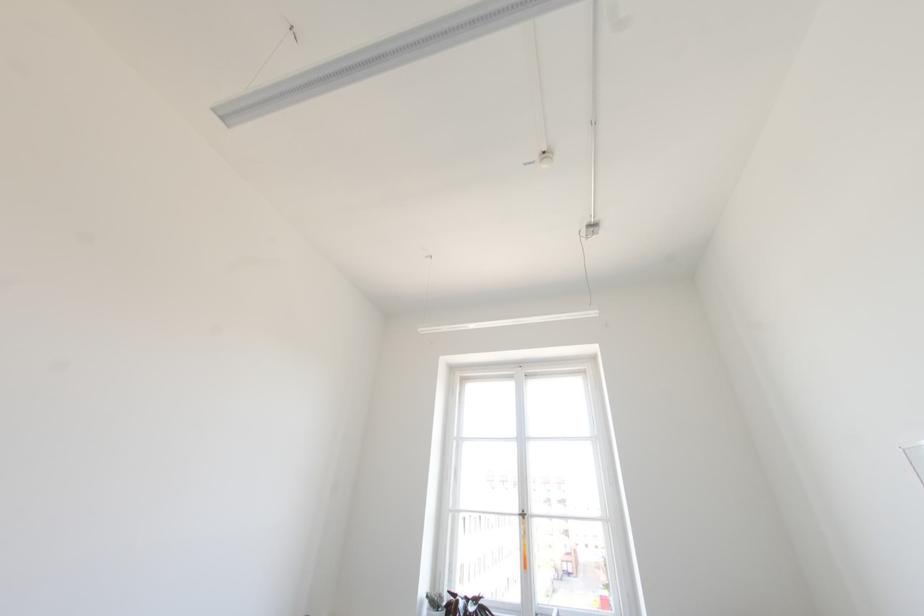
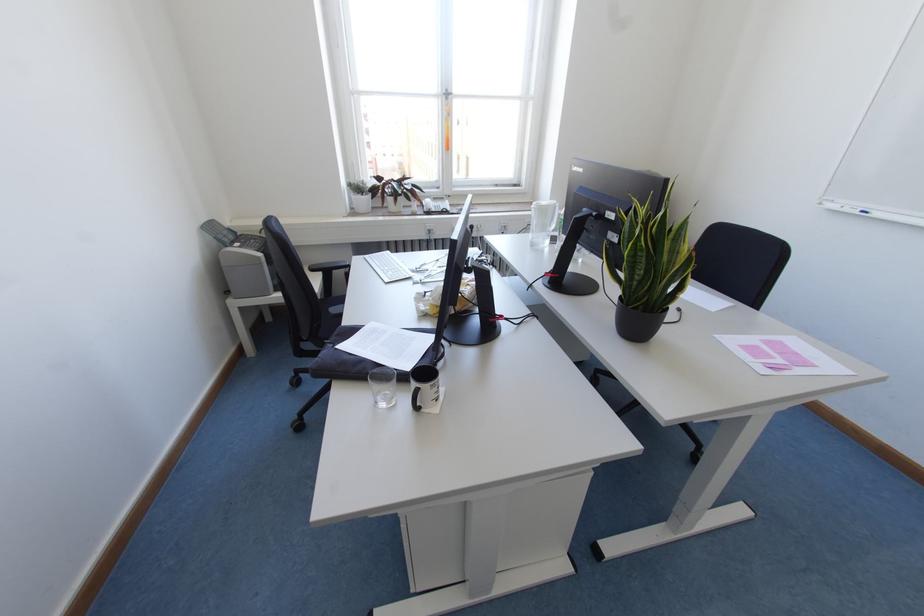
Locate, in the second image, the point that corresponds to the point at 523,517 in the first image.

(446, 98)